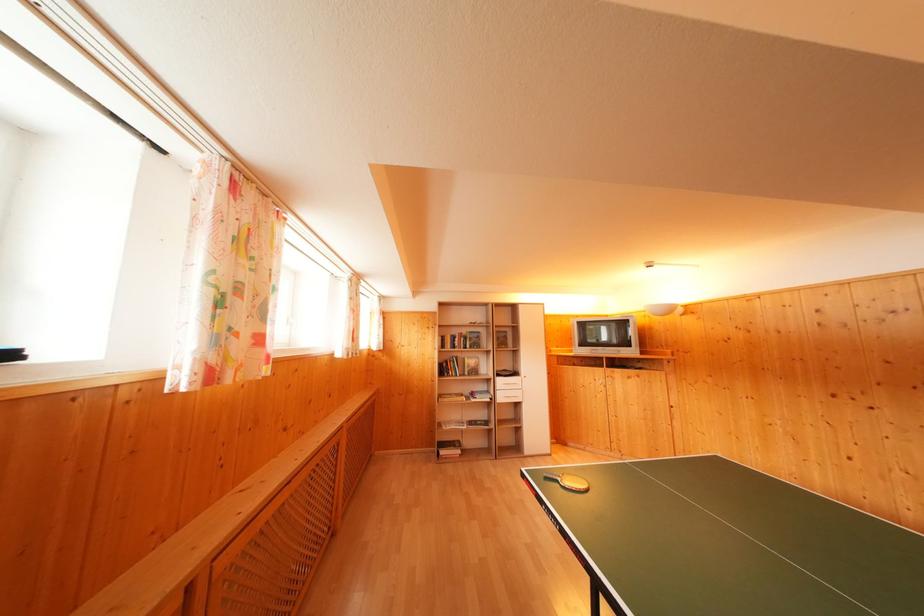
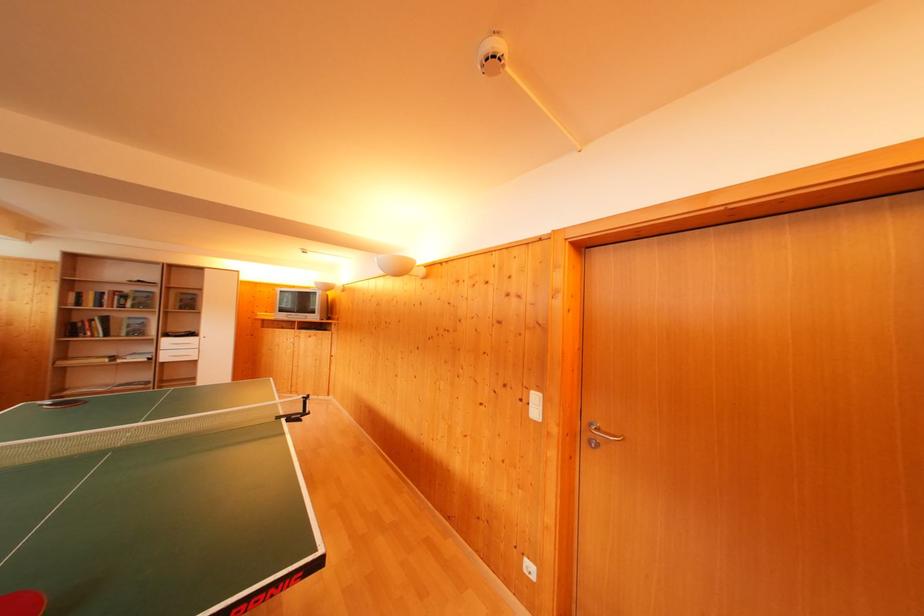
Locate, in the second image, the point that corresponds to point 447,375 in the first image.

(76, 334)